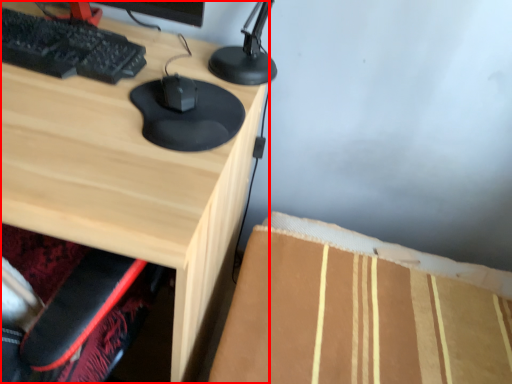
Question: Considering the relative positions of desk (annotated by the red box) and mouse in the image provided, where is desk (annotated by the red box) located with respect to the staircase?

Choices:
 (A) right
 (B) left

Answer: (B)